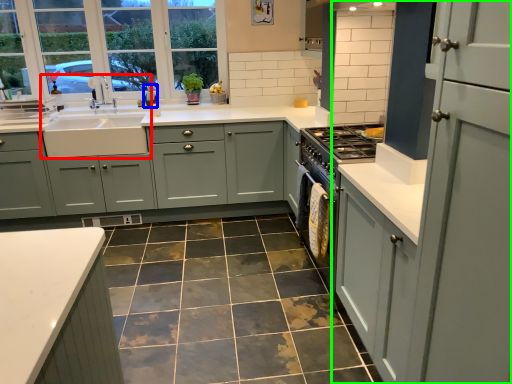
Question: Considering the real-world distances, which object is closest to sink (highlighted by a red box)? teal (highlighted by a blue box) or cabinetry (highlighted by a green box).

Choices:
 (A) teal
 (B) cabinetry

Answer: (A)